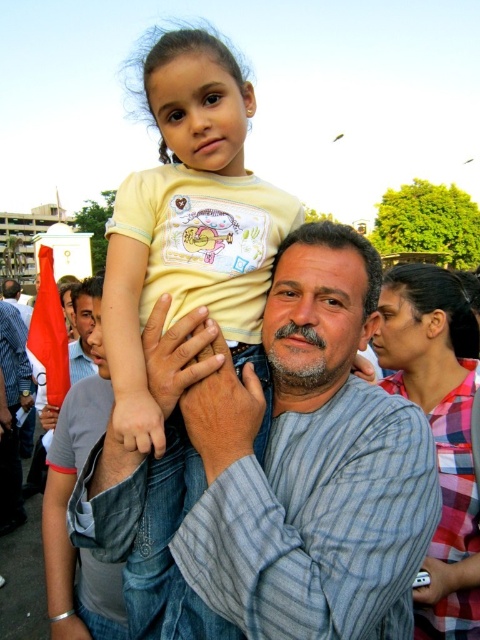
Question: Which point is closer to the camera?

Choices:
 (A) (414, 336)
 (B) (158, 244)

Answer: (B)

Question: Does yellow matte shirt at upper center have a smaller size compared to matte yellow shirt at upper center?

Choices:
 (A) yes
 (B) no

Answer: (A)

Question: Does striped cotton shirt at center have a smaller size compared to gray striped shirt at center?

Choices:
 (A) no
 (B) yes

Answer: (B)

Question: Which object is closer to the camera taking this photo?

Choices:
 (A) gray striped shirt at center
 (B) matte yellow shirt at upper center
 (C) striped cotton shirt at center

Answer: (C)

Question: Among these objects, which one is nearest to the camera?

Choices:
 (A) striped cotton shirt at center
 (B) gray striped shirt at center
 (C) matte yellow shirt at upper center

Answer: (A)

Question: Can you confirm if yellow matte shirt at upper center is positioned above gray striped shirt at center?

Choices:
 (A) yes
 (B) no

Answer: (B)